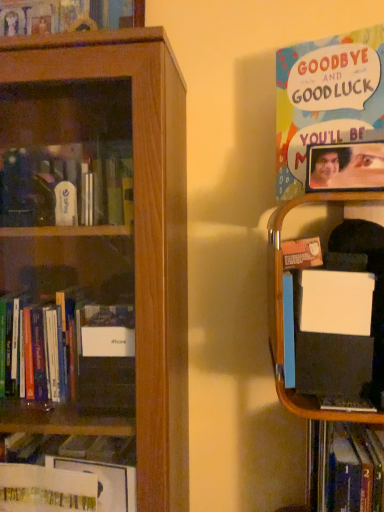
Question: Does point (344, 476) appear closer or farther from the camera than point (292, 136)?

Choices:
 (A) farther
 (B) closer

Answer: (B)

Question: From the image's perspective, is hardcover book at lower right, the first book when ordered from bottom to top, located above or below multicolored paper poster at upper right, the second book when ordered from bottom to top?

Choices:
 (A) above
 (B) below

Answer: (B)

Question: Which object is the farthest from the wooden bookcase at left?

Choices:
 (A) multicolored paper poster at upper right, the second book when ordered from bottom to top
 (B) hardcover book at lower right, marked as the second book in a top-to-bottom arrangement
 (C) wooden picture frame at upper right

Answer: (B)

Question: Which is nearer to the wooden bookcase at left?

Choices:
 (A) multicolored paper poster at upper right, positioned as the first book in top-to-bottom order
 (B) hardcover book at lower right, the first book when ordered from bottom to top
 (C) wooden picture frame at upper right

Answer: (A)